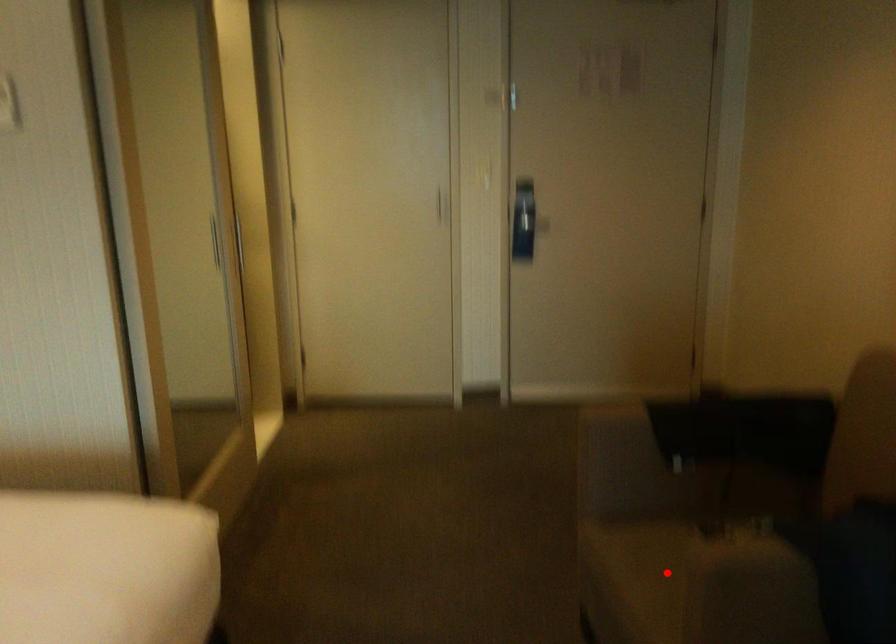
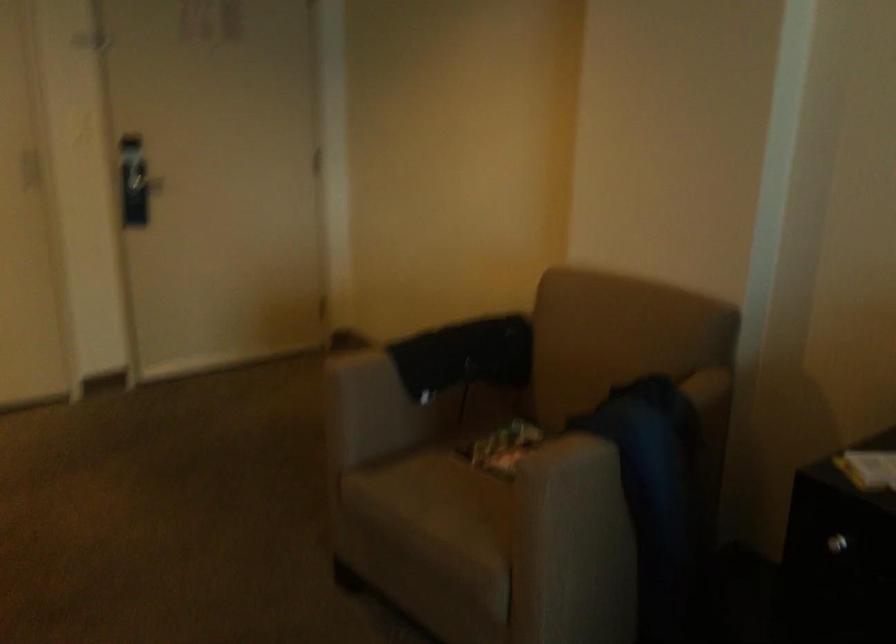
The point at the highlighted location is marked in the first image. Where is the corresponding point in the second image?

(453, 500)